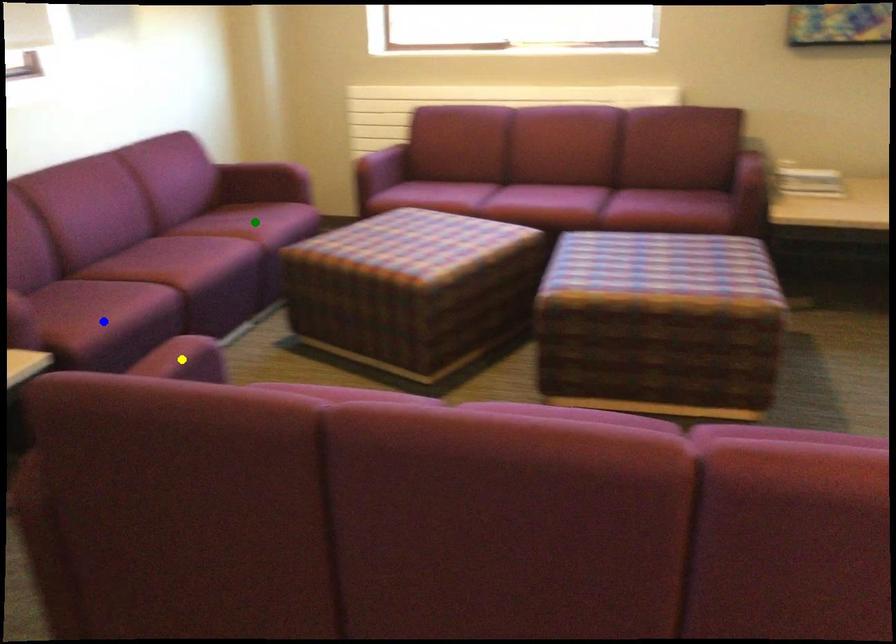
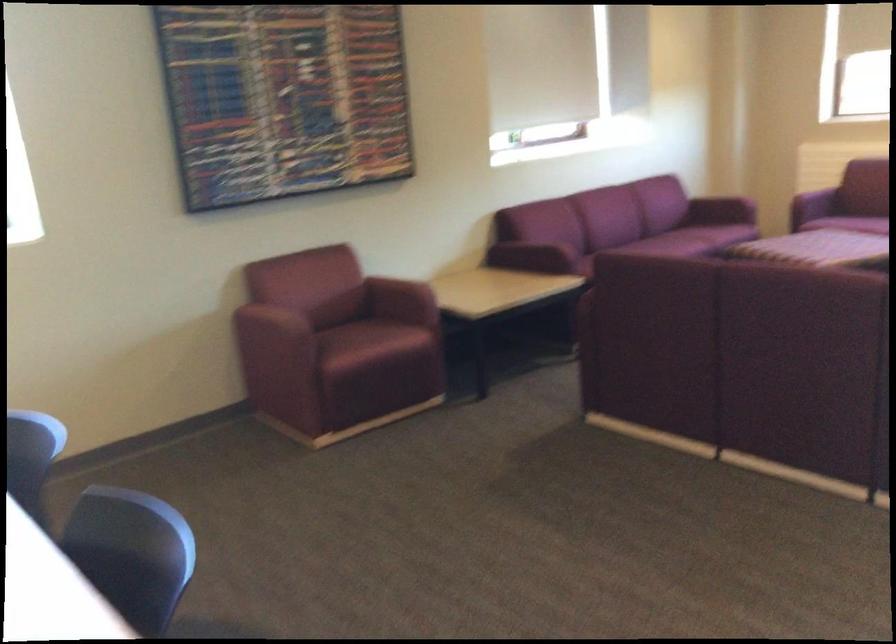
I am providing you with two images of the same scene from different viewpoints. Three points are marked in image1. Which point corresponds to a part or object that is occluded in image2?In image1, three points are marked. Which of them correspond to a part or object that is occluded in image2?Among the three points shown in image1, which one corresponds to a part or object that is no longer visible due to occlusion in image2?

green point, blue point, yellow point